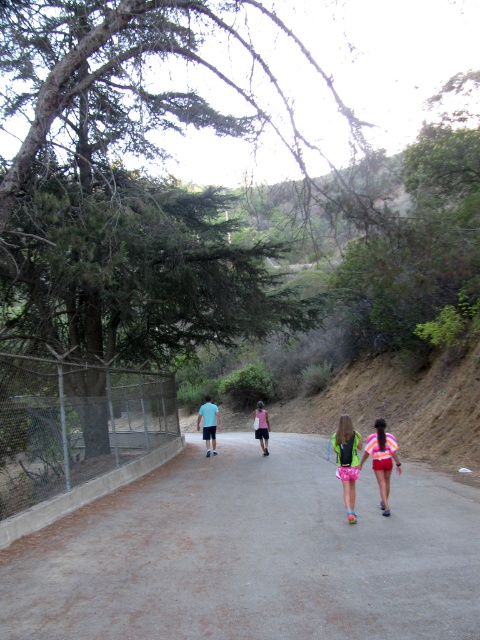
Question: Considering the relative positions of gray asphalt road at center and neon pink fabric shorts at center in the image provided, where is gray asphalt road at center located with respect to neon pink fabric shorts at center?

Choices:
 (A) below
 (B) above

Answer: (A)

Question: Is gray asphalt road at center to the left of pink fabric dress at center from the viewer's perspective?

Choices:
 (A) yes
 (B) no

Answer: (A)

Question: Among these points, which one is farthest from the camera?

Choices:
 (A) (345, 477)
 (B) (375, 451)

Answer: (B)

Question: Which point is closer to the camera taking this photo?

Choices:
 (A) (471, 564)
 (B) (266, 419)
 (C) (200, 417)

Answer: (A)

Question: Among these objects, which one is farthest from the camera?

Choices:
 (A) neon pink fabric shorts at center
 (B) gray asphalt road at center

Answer: (A)

Question: Does shiny pink skirt at center appear on the left side of blue cotton shorts at center?

Choices:
 (A) yes
 (B) no

Answer: (B)